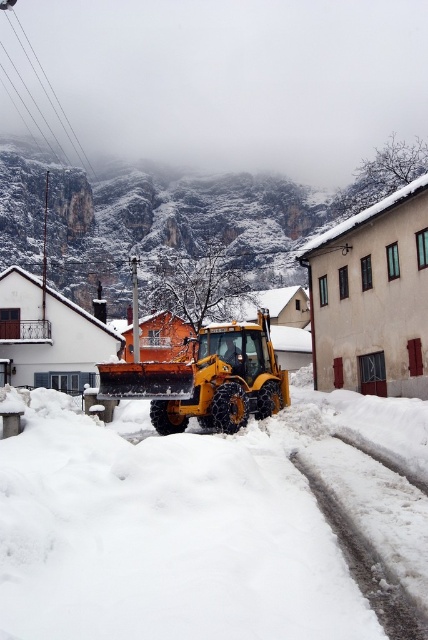
You are a delivery driver trying to navigate through the snow. You see the white fluffy snow at center and the yellow rubber plow at center. Which object is located to the right of the other?

The white fluffy snow at center is to the right of the yellow rubber plow at center.

You are a delivery person trying to navigate through the snowy street. You see the white fluffy snow at center and the yellow rubber plow at center. Which object is closer to you?

The white fluffy snow at center is closer to the viewer than the yellow rubber plow at center, so the white fluffy snow at center is closer to you.